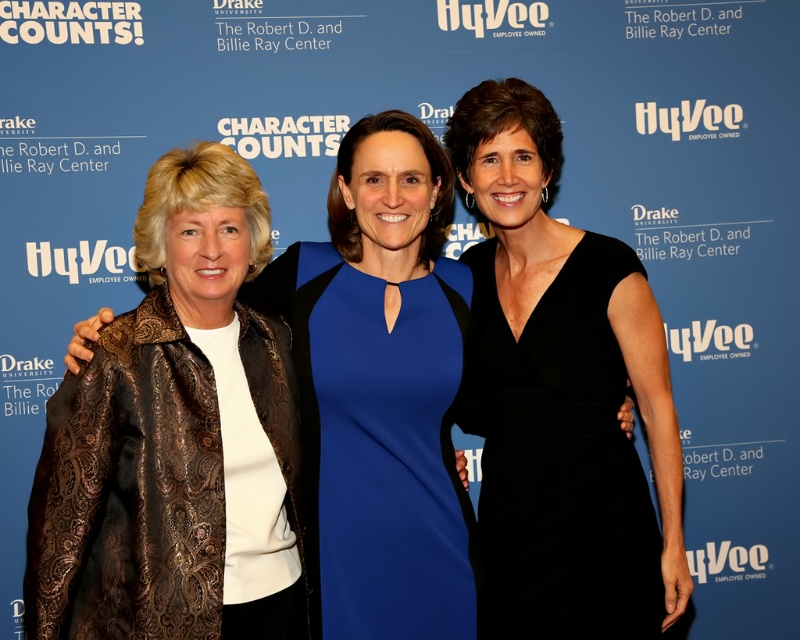
Question: Which point is farther to the camera?

Choices:
 (A) (624, 611)
 (B) (358, 198)

Answer: (A)

Question: Is black satin dress at center below bronze textured jacket at left?

Choices:
 (A) yes
 (B) no

Answer: (B)

Question: Which point appears farthest from the camera in this image?

Choices:
 (A) (520, 348)
 (B) (429, 596)

Answer: (A)

Question: Can you confirm if black satin dress at center is positioned to the right of bronze textured jacket at left?

Choices:
 (A) yes
 (B) no

Answer: (A)

Question: Is black satin dress at center in front of bronze textured jacket at left?

Choices:
 (A) yes
 (B) no

Answer: (B)

Question: Which point appears farthest from the camera in this image?

Choices:
 (A) (562, 257)
 (B) (364, 627)

Answer: (A)